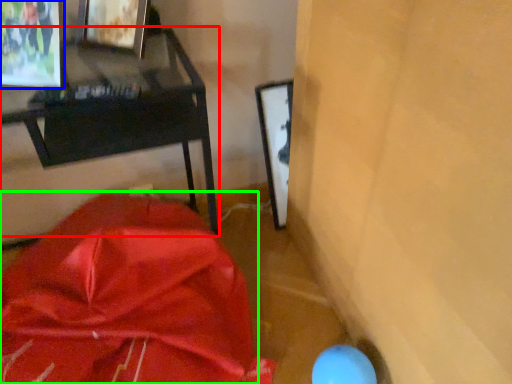
Question: Estimate the real-world distances between objects in this image. Which object is farther from furniture (highlighted by a red box), picture frame (highlighted by a blue box) or wrap (highlighted by a green box)?

Choices:
 (A) picture frame
 (B) wrap

Answer: (B)